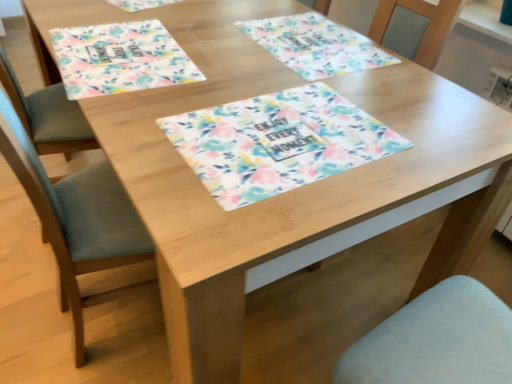
Question: Does floral fabric placemat at upper left, the first place mat in the left-to-right sequence, have a greater height compared to floral fabric placemat at center?

Choices:
 (A) yes
 (B) no

Answer: (A)

Question: Is the depth of floral fabric placemat at upper left, the first place mat in the left-to-right sequence, less than that of floral fabric placemat at center?

Choices:
 (A) yes
 (B) no

Answer: (B)

Question: Is floral fabric placemat at upper left, placed as the second place mat when sorted from right to left, looking in the opposite direction of floral fabric placemat at center?

Choices:
 (A) no
 (B) yes

Answer: (A)

Question: Is floral fabric placemat at upper left, the first place mat in the left-to-right sequence, next to floral fabric placemat at center and touching it?

Choices:
 (A) yes
 (B) no

Answer: (B)

Question: Would you say floral fabric placemat at center, the first place mat when ordered from right to left, is to the left or to the right of floral fabric placemat at center in the picture?

Choices:
 (A) right
 (B) left

Answer: (A)

Question: Is floral fabric placemat at center, positioned as the second place mat in left-to-right order, in front of or behind floral fabric placemat at center in the image?

Choices:
 (A) front
 (B) behind

Answer: (B)

Question: From the image's perspective, is floral fabric placemat at center, the first place mat when ordered from right to left, positioned above or below floral fabric placemat at center?

Choices:
 (A) above
 (B) below

Answer: (A)

Question: From a real-world perspective, relative to floral fabric placemat at center, is floral fabric placemat at center, the first place mat when ordered from right to left, vertically above or below?

Choices:
 (A) above
 (B) below

Answer: (B)

Question: Choose the correct answer: Is floral fabric placemat at upper left, placed as the second place mat when sorted from right to left, inside floral fabric placemat at center, the first place mat when ordered from right to left, or outside it?

Choices:
 (A) outside
 (B) inside

Answer: (A)

Question: Looking at their shapes, would you say floral fabric placemat at upper left, the first place mat in the left-to-right sequence, is wider or thinner than floral fabric placemat at center, positioned as the second place mat in left-to-right order?

Choices:
 (A) thin
 (B) wide

Answer: (B)

Question: In terms of height, does floral fabric placemat at upper left, the first place mat in the left-to-right sequence, look taller or shorter compared to floral fabric placemat at center, the first place mat when ordered from right to left?

Choices:
 (A) tall
 (B) short

Answer: (A)

Question: From a real-world perspective, is floral fabric placemat at upper left, placed as the second place mat when sorted from right to left, physically located above or below floral fabric placemat at center, positioned as the second place mat in left-to-right order?

Choices:
 (A) above
 (B) below

Answer: (B)

Question: Considering the positions of floral fabric placemat at center, the first place mat when ordered from right to left, and floral fabric placemat at upper left, placed as the second place mat when sorted from right to left, in the image, is floral fabric placemat at center, the first place mat when ordered from right to left, taller or shorter than floral fabric placemat at upper left, placed as the second place mat when sorted from right to left,?

Choices:
 (A) tall
 (B) short

Answer: (B)

Question: Considering the positions of point pos(310,39) and point pos(101,84), is point pos(310,39) closer or farther from the camera than point pos(101,84)?

Choices:
 (A) farther
 (B) closer

Answer: (A)